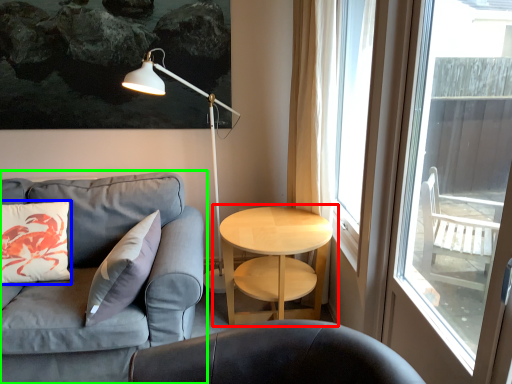
Question: Which object is positioned farthest from table (highlighted by a red box)? Select from pillow (highlighted by a blue box) and studio couch (highlighted by a green box).

Choices:
 (A) pillow
 (B) studio couch

Answer: (A)